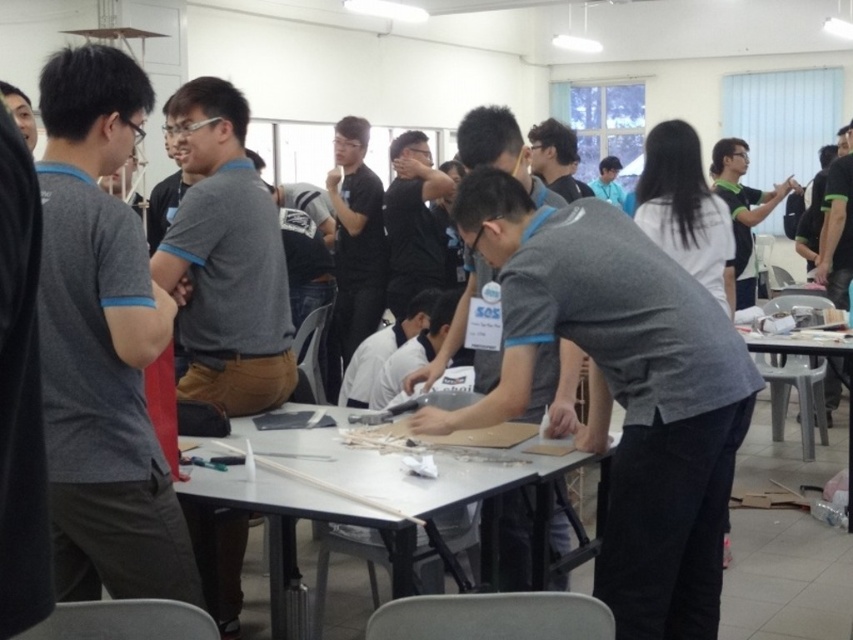
Where is the gray matte shirt at center located in the image?

The gray matte shirt at center is located at point [621,390] in the image.

You are a photographer trying to capture a group photo of the gray matte shirt at center and the clear plastic table at right. Which object should you focus on first if you want to ensure both are in focus, considering their sizes?

The gray matte shirt at center is larger in size than the clear plastic table at right, so you should focus on the gray matte shirt at center first to ensure both are in focus.